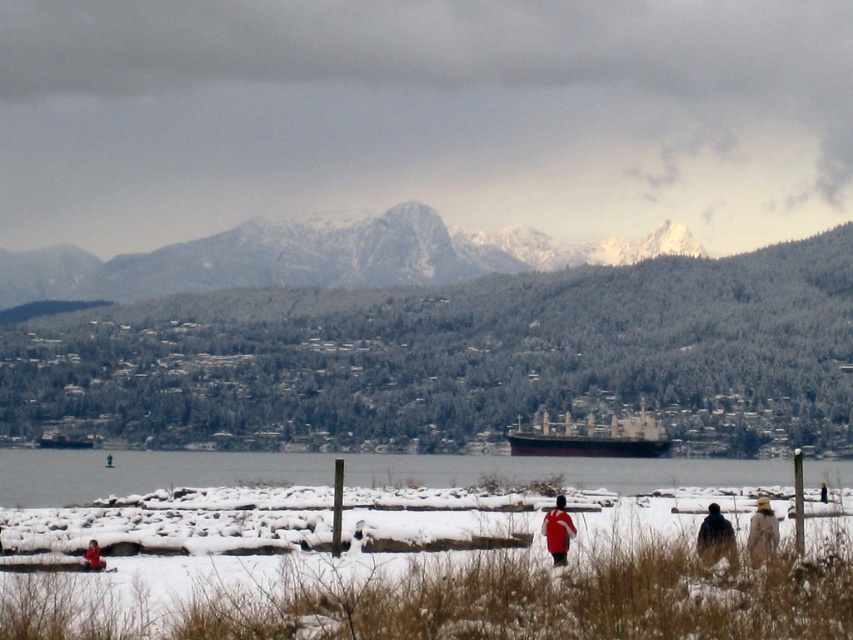
You are a photographer trying to capture a wide shot of the winter scene. You notice the clear water at lower center and the red matte jacket at lower left. Which object would appear bigger in your photo?

The clear water at lower center would appear bigger in the photo because it has a larger size compared to the red matte jacket at lower left.

You are standing at the edge of the water and want to reach the point marked by point (474, 460) and point (96, 552). Which point is closer to you?

Point (474, 460) is closer to you because it is further to the camera than point (96, 552).

Looking at this image, you are standing at the point marked as point [457,358] in the winter landscape image. What can you see directly in front of you?

You can see a snowy forested mountain at center directly in front of you at point [457,358].